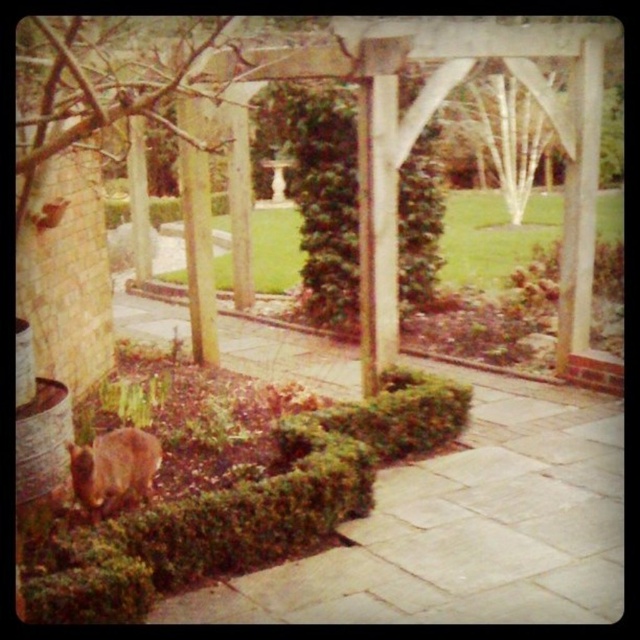
In the scene shown: Does green leafy bush at center have a greater width compared to brown furry rabbit at lower left?

Yes.

The width and height of the screenshot is (640, 640). Find the location of `green leafy bush at center`. green leafy bush at center is located at coordinates (324, 202).